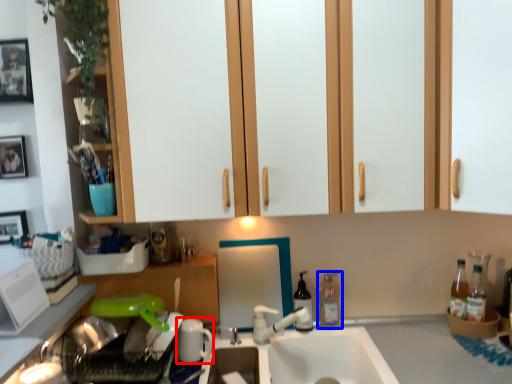
Question: Which object is closer to the camera taking this photo, appliance (highlighted by a red box) or bottle (highlighted by a blue box)?

Choices:
 (A) appliance
 (B) bottle

Answer: (A)